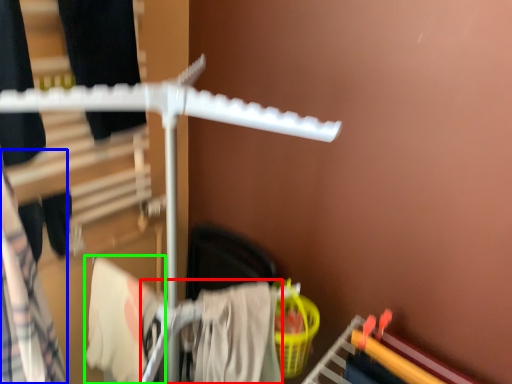
Question: Estimate the real-world distances between objects in this image. Which object is farther from clothing (highlighted by a red box), clothing (highlighted by a blue box) or clothing (highlighted by a green box)?

Choices:
 (A) clothing
 (B) clothing

Answer: (A)